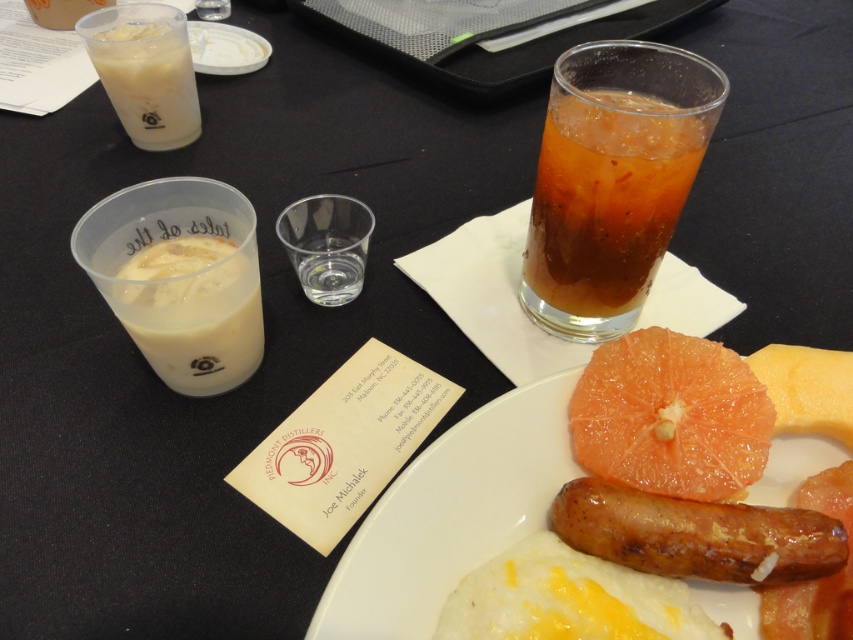
Does milky white liquid at left have a lesser height compared to white opaque cup at upper left?

Correct, milky white liquid at left is not as tall as white opaque cup at upper left.

Based on the photo, does milky white liquid at left come behind white opaque cup at upper left?

No, milky white liquid at left is closer to the viewer.

What do you see at coordinates (193, 312) in the screenshot? This screenshot has height=640, width=853. I see `milky white liquid at left` at bounding box center [193, 312].

Where is `milky white liquid at left`? The width and height of the screenshot is (853, 640). milky white liquid at left is located at coordinates (193, 312).

Can you confirm if yellow fried egg at lower center is wider than orange matte grapefruit at center?

Yes, yellow fried egg at lower center is wider than orange matte grapefruit at center.

Between point (527, 616) and point (775, 352), which one is positioned behind?

Point (775, 352)

Is point (577, 557) more distant than point (793, 390)?

No, (577, 557) is in front of (793, 390).

Image resolution: width=853 pixels, height=640 pixels. I want to click on yellow fried egg at lower center, so click(x=567, y=600).

Does yellow fried egg at lower center lie in front of white opaque cup at upper left?

Yes, it is in front of white opaque cup at upper left.

Which of these two, yellow fried egg at lower center or white opaque cup at upper left, stands taller?

white opaque cup at upper left is taller.

Find the location of a particular element. yellow fried egg at lower center is located at coordinates (567, 600).